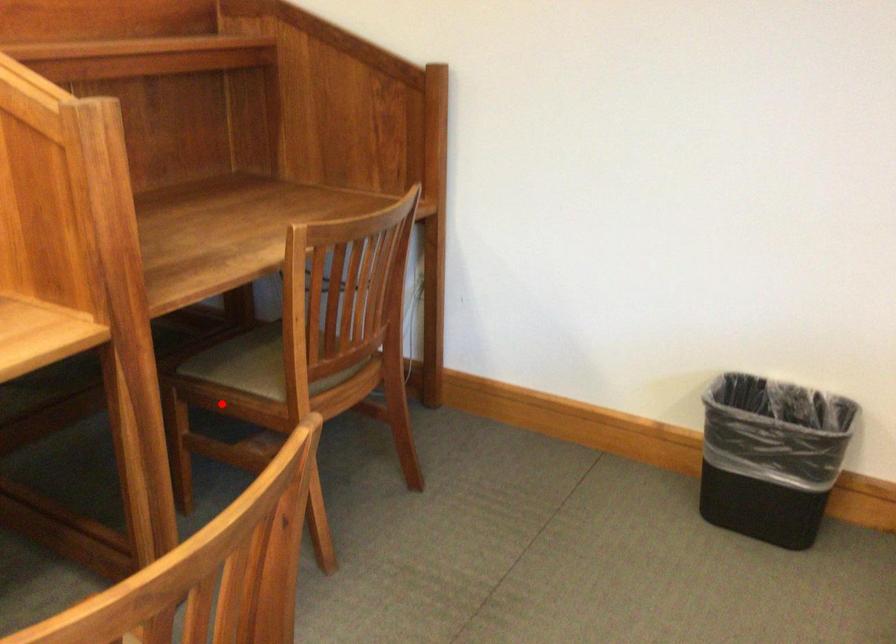
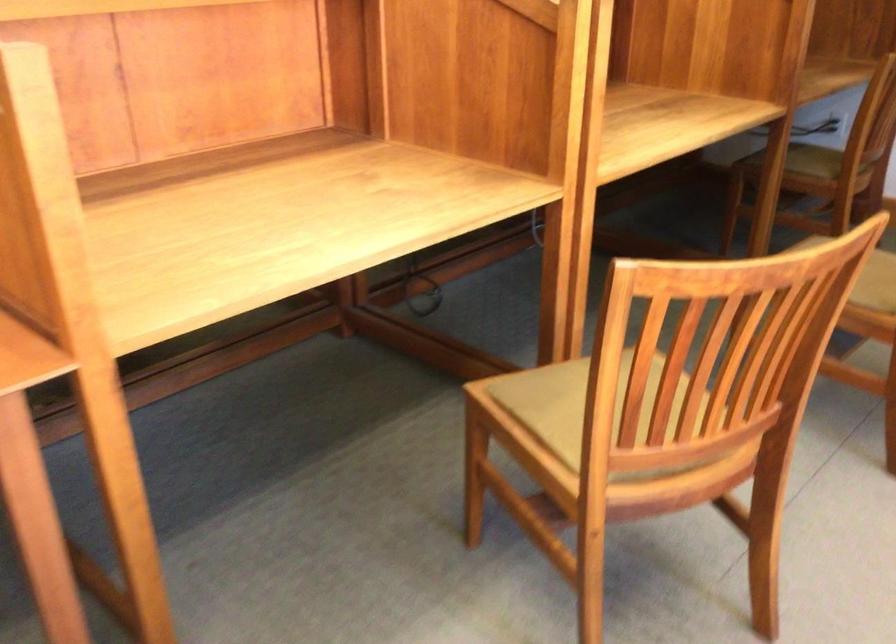
Question: I am providing you with two images of the same scene from different viewpoints. A red point is shown in image1. For the corresponding object point in image2, is it positioned nearer or farther from the camera?

Choices:
 (A) Nearer
 (B) Farther

Answer: (B)